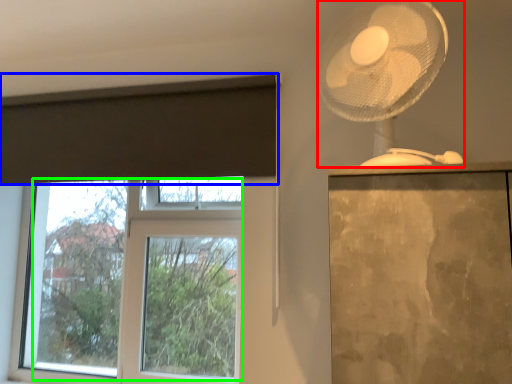
Question: Estimate the real-world distances between objects in this image. Which object is farther from mechanical fan (highlighted by a red box), curtain (highlighted by a blue box) or bay window (highlighted by a green box)?

Choices:
 (A) curtain
 (B) bay window

Answer: (B)